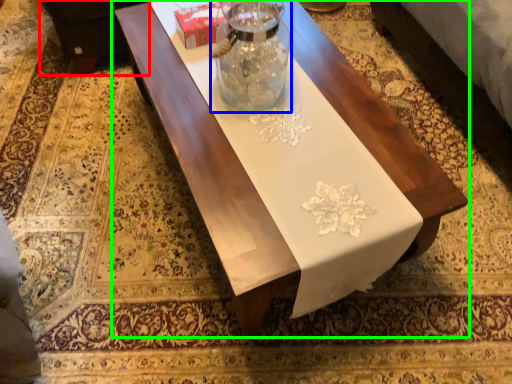
Question: Considering the real-world distances, which object is farthest from couch (highlighted by a red box)? glass vase (highlighted by a blue box) or table (highlighted by a green box)?

Choices:
 (A) glass vase
 (B) table

Answer: (A)